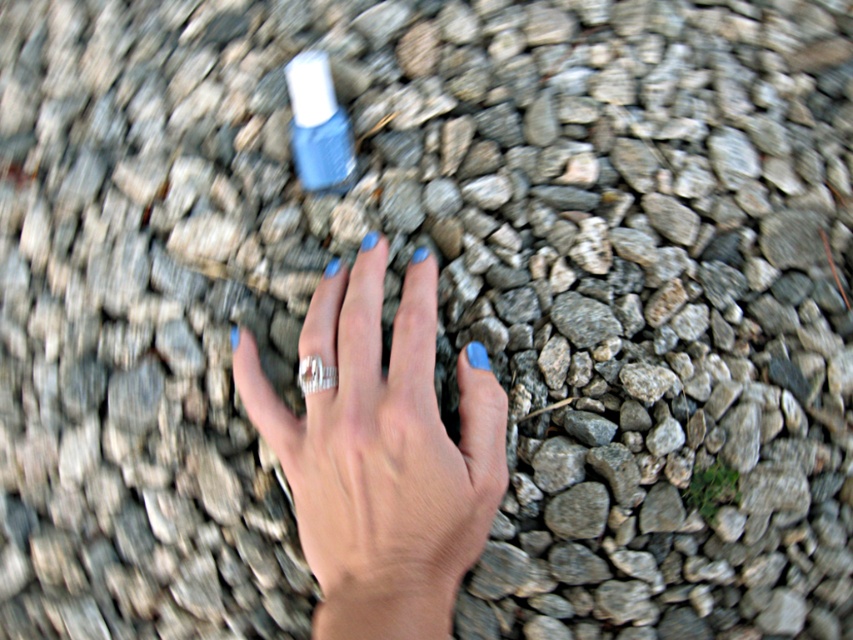
Between blue matte nail polish at center and silver metallic ring at center, which one is positioned higher?

silver metallic ring at center is higher up.

What are the coordinates of `blue matte nail polish at center` in the screenshot? It's located at (381, 452).

Where is `blue matte nail polish at center`? blue matte nail polish at center is located at coordinates (381, 452).

Which of these two, blue glass nail polish at center or silver metallic ring at center, stands taller?

blue glass nail polish at center is taller.

How distant is blue glass nail polish at center from silver metallic ring at center?

blue glass nail polish at center is 9.35 inches away from silver metallic ring at center.

Locate an element on the screen. The width and height of the screenshot is (853, 640). blue glass nail polish at center is located at coordinates (318, 125).

Who is higher up, blue matte nail polish at center or blue glass nail polish at center?

Positioned higher is blue glass nail polish at center.

The width and height of the screenshot is (853, 640). I want to click on blue matte nail polish at center, so click(381, 452).